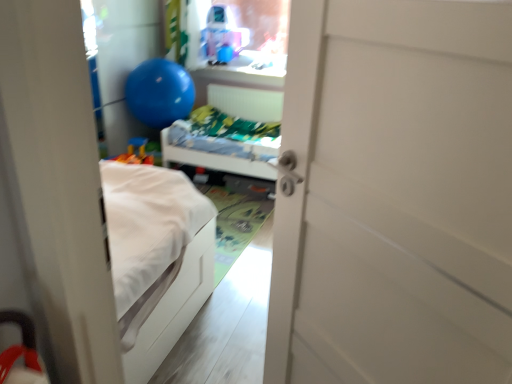
Where is `blue rubber balloon at upper left`? blue rubber balloon at upper left is located at coordinates (159, 93).

What do you see at coordinates (221, 155) in the screenshot?
I see `white matte hospital bed at center` at bounding box center [221, 155].

This screenshot has width=512, height=384. I want to click on blue rubber balloon at upper left, so click(x=159, y=93).

Which is in front, point (412, 279) or point (210, 19)?

The point (412, 279) is closer to the camera.

Is white matte door at center outside of translucent plastic toy at upper center?

Yes.

Is white matte door at center aimed at translucent plastic toy at upper center?

No, white matte door at center does not turn towards translucent plastic toy at upper center.

Is the position of white matte door at center less distant than that of translucent plastic toy at upper center?

Yes, white matte door at center is closer to the viewer.

Is white matte door at center looking in the opposite direction of white matte hospital bed at center?

white matte door at center does not have its back to white matte hospital bed at center.

Would you say white matte hospital bed at center is part of white matte door at center's contents?

Actually, white matte hospital bed at center is outside white matte door at center.

Between point (465, 246) and point (226, 170), which one is positioned in front?

The point (465, 246) is more forward.

Is the surface of white matte door at center in direct contact with white matte hospital bed at center?

No, white matte door at center is not touching white matte hospital bed at center.

Can you confirm if white matte hospital bed at center is smaller than translucent plastic toy at upper center?

No, white matte hospital bed at center is not smaller than translucent plastic toy at upper center.

From their relative heights in the image, would you say white matte hospital bed at center is taller or shorter than translucent plastic toy at upper center?

In the image, white matte hospital bed at center appears to be taller than translucent plastic toy at upper center.

Locate an element on the screen. This screenshot has width=512, height=384. hospital bed in front of the translucent plastic toy at upper center is located at coordinates (221, 155).

Does point (222, 153) appear closer or farther from the camera than point (218, 42)?

Clearly, point (222, 153) is closer to the camera than point (218, 42).

Is white matte hospital bed at center in contact with blue rubber balloon at upper left?

white matte hospital bed at center is not next to blue rubber balloon at upper left, and they're not touching.

How distant is white matte hospital bed at center from blue rubber balloon at upper left?

A distance of 14.36 inches exists between white matte hospital bed at center and blue rubber balloon at upper left.

In the image, is white matte hospital bed at center positioned in front of or behind blue rubber balloon at upper left?

white matte hospital bed at center is positioned closer to the viewer than blue rubber balloon at upper left.

Is white matte hospital bed at center looking in the opposite direction of blue rubber balloon at upper left?

No, white matte hospital bed at center is not facing away from blue rubber balloon at upper left.

Measure the distance from translucent plastic toy at upper center to blue rubber balloon at upper left.

translucent plastic toy at upper center and blue rubber balloon at upper left are 29.09 inches apart from each other.

Is translucent plastic toy at upper center inside the boundaries of blue rubber balloon at upper left, or outside?

translucent plastic toy at upper center is spatially situated outside blue rubber balloon at upper left.

Who is bigger, translucent plastic toy at upper center or blue rubber balloon at upper left?

With larger size is blue rubber balloon at upper left.

Is translucent plastic toy at upper center taller than blue rubber balloon at upper left?

Incorrect, the height of translucent plastic toy at upper center is not larger of that of blue rubber balloon at upper left.

Is white matte door at center completely or partially outside of blue rubber balloon at upper left?

Absolutely, white matte door at center is external to blue rubber balloon at upper left.

Can you confirm if white matte door at center is bigger than blue rubber balloon at upper left?

No.

Measure the distance from white matte door at center to blue rubber balloon at upper left.

They are 2.69 meters apart.

Identify the location of balloon below the white matte door at center (from a real-world perspective). This screenshot has height=384, width=512. (159, 93).

Is blue rubber balloon at upper left turned away from translucent plastic toy at upper center?

Absolutely, blue rubber balloon at upper left is directed away from translucent plastic toy at upper center.

Considering the positions of objects blue rubber balloon at upper left and translucent plastic toy at upper center in the image provided, who is in front, blue rubber balloon at upper left or translucent plastic toy at upper center?

Positioned in front is blue rubber balloon at upper left.

Considering the sizes of blue rubber balloon at upper left and translucent plastic toy at upper center in the image, is blue rubber balloon at upper left wider or thinner than translucent plastic toy at upper center?

blue rubber balloon at upper left is wider than translucent plastic toy at upper center.

In the image, is blue rubber balloon at upper left on the left side or the right side of translucent plastic toy at upper center?

blue rubber balloon at upper left is to the left of translucent plastic toy at upper center.

Locate an element on the screen. The height and width of the screenshot is (384, 512). door that is under the translucent plastic toy at upper center (from a real-world perspective) is located at coordinates (395, 195).

Find the location of a particular element. door located below the white matte hospital bed at center (from the image's perspective) is located at coordinates click(x=395, y=195).

When comparing their distances from translucent plastic toy at upper center, does blue rubber balloon at upper left or white matte hospital bed at center seem further?

white matte hospital bed at center is positioned further to the anchor translucent plastic toy at upper center.

Based on their spatial positions, is translucent plastic toy at upper center or white matte door at center further from blue rubber balloon at upper left?

white matte door at center lies further to blue rubber balloon at upper left than the other object.

Looking at the image, which one is located further to blue rubber balloon at upper left, white matte hospital bed at center or translucent plastic toy at upper center?

Among the two, translucent plastic toy at upper center is located further to blue rubber balloon at upper left.

Which object lies nearer to the anchor point blue rubber balloon at upper left, white matte door at center or white matte hospital bed at center?

The object closer to blue rubber balloon at upper left is white matte hospital bed at center.

Which object lies further to the anchor point white matte hospital bed at center, white matte door at center or translucent plastic toy at upper center?

Based on the image, white matte door at center appears to be further to white matte hospital bed at center.

Considering their positions, is white matte hospital bed at center positioned closer to white matte door at center than blue rubber balloon at upper left?

Based on the image, white matte hospital bed at center appears to be nearer to white matte door at center.

Based on their spatial positions, is blue rubber balloon at upper left or white matte hospital bed at center further from white matte door at center?

Among the two, blue rubber balloon at upper left is located further to white matte door at center.

Considering their positions, is blue rubber balloon at upper left positioned closer to translucent plastic toy at upper center than white matte door at center?

blue rubber balloon at upper left lies closer to translucent plastic toy at upper center than the other object.

I want to click on hospital bed between white matte door at center and blue rubber balloon at upper left from front to back, so click(x=221, y=155).

Where is `balloon between translucent plastic toy at upper center and white matte hospital bed at center from top to bottom`? The width and height of the screenshot is (512, 384). balloon between translucent plastic toy at upper center and white matte hospital bed at center from top to bottom is located at coordinates (159, 93).

This screenshot has height=384, width=512. Find the location of `hospital bed between white matte door at center and translucent plastic toy at upper center along the z-axis`. hospital bed between white matte door at center and translucent plastic toy at upper center along the z-axis is located at coordinates click(x=221, y=155).

Image resolution: width=512 pixels, height=384 pixels. In order to click on balloon between white matte door at center and translucent plastic toy at upper center along the z-axis in this screenshot , I will do `click(159, 93)`.